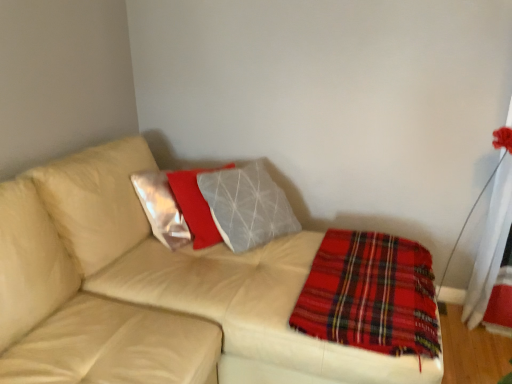
Question: Considering the positions of point (5, 289) and point (429, 342), is point (5, 289) closer or farther from the camera than point (429, 342)?

Choices:
 (A) farther
 (B) closer

Answer: (B)

Question: Is leather couch at center bigger or smaller than red plaid blanket at lower right?

Choices:
 (A) big
 (B) small

Answer: (A)

Question: Is leather couch at center spatially inside red plaid blanket at lower right, or outside of it?

Choices:
 (A) inside
 (B) outside

Answer: (B)

Question: Is point (424, 274) positioned closer to the camera than point (105, 365)?

Choices:
 (A) closer
 (B) farther

Answer: (B)

Question: Relative to leather couch at center, is red plaid blanket at lower right in front or behind?

Choices:
 (A) front
 (B) behind

Answer: (B)

Question: From a real-world perspective, is red plaid blanket at lower right positioned above or below leather couch at center?

Choices:
 (A) above
 (B) below

Answer: (A)

Question: Is red plaid blanket at lower right to the left or to the right of leather couch at center in the image?

Choices:
 (A) right
 (B) left

Answer: (A)